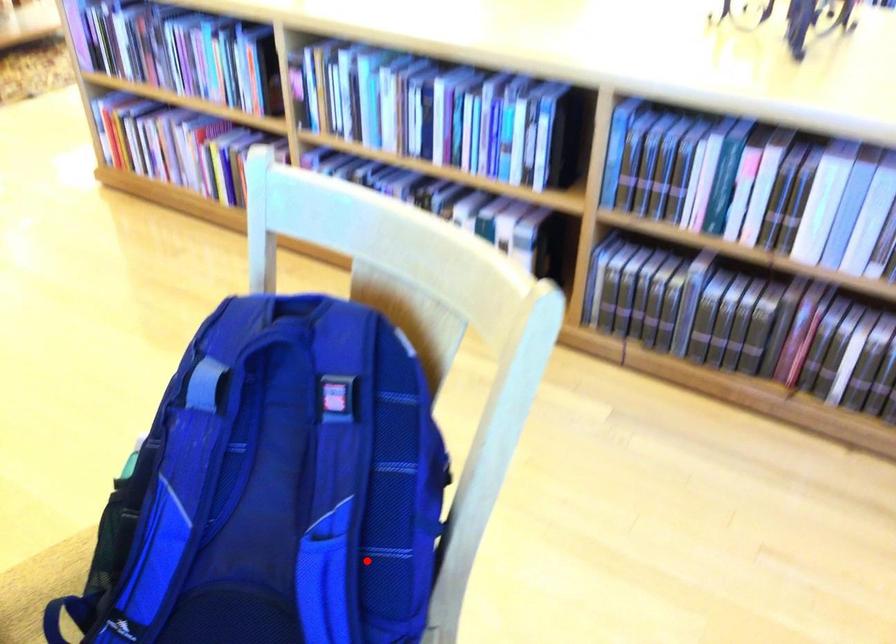
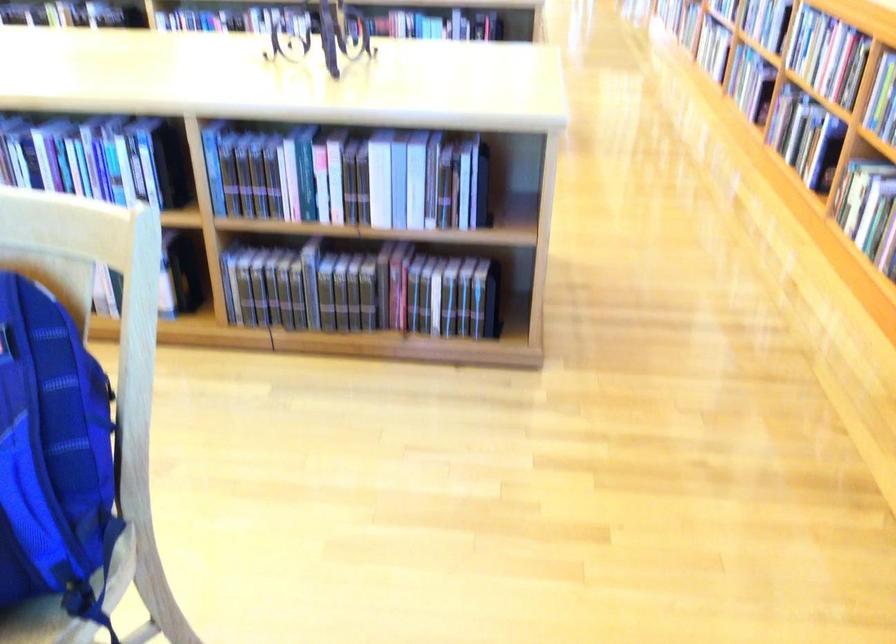
The point at the highlighted location is marked in the first image. Where is the corresponding point in the second image?

(53, 458)